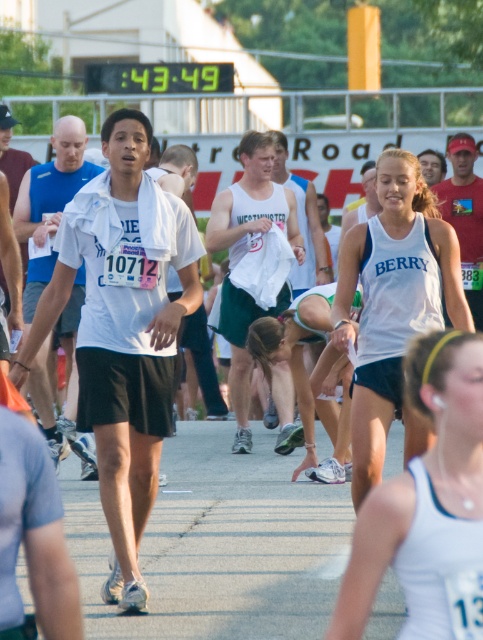
Can you confirm if white matte shirt at center is taller than white tank top at center?

Correct, white matte shirt at center is much taller as white tank top at center.

Looking at this image, is white matte shirt at center positioned in front of white tank top at center?

No, it is not.

Which is behind, point (83, 216) or point (453, 529)?

Point (83, 216)

Find the location of a particular element. white matte shirt at center is located at coordinates (123, 328).